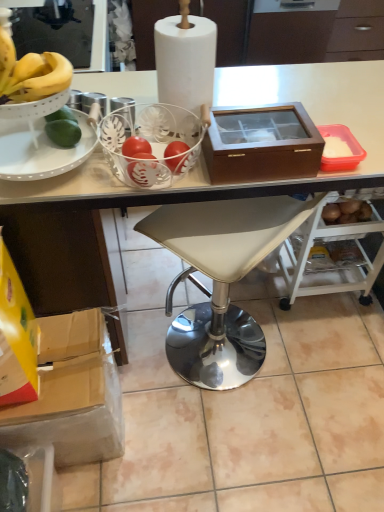
Find the location of a particular element. This screenshot has width=384, height=512. vacant area in front of white leather stool at center is located at coordinates (226, 443).